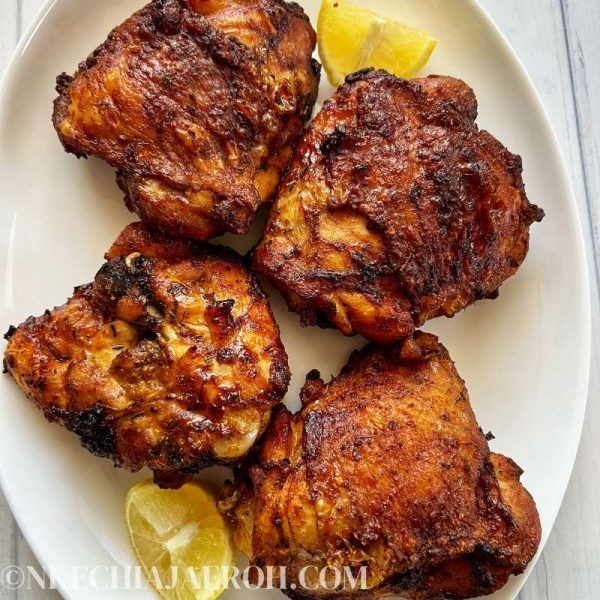
Identify the location of plate. (580, 378), (585, 534).